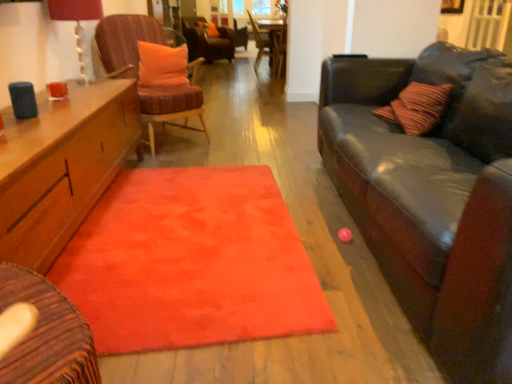
Question: Does orange fabric pillow at center, which ranks as the 1th pillow in top-to-bottom order, have a larger size compared to wooden table at center?

Choices:
 (A) no
 (B) yes

Answer: (A)

Question: Considering the relative positions of orange fabric pillow at center, the first pillow in the back-to-front sequence, and wooden table at center in the image provided, is orange fabric pillow at center, the first pillow in the back-to-front sequence, to the right of wooden table at center from the viewer's perspective?

Choices:
 (A) yes
 (B) no

Answer: (B)

Question: From the image's perspective, is orange fabric pillow at center, the 2th pillow in the bottom-to-top sequence, over wooden table at center?

Choices:
 (A) no
 (B) yes

Answer: (B)

Question: Are orange fabric pillow at center, which ranks as the 1th pillow in top-to-bottom order, and wooden table at center located far from each other?

Choices:
 (A) yes
 (B) no

Answer: (A)

Question: Considering the relative positions of orange fabric pillow at center, the first pillow in the back-to-front sequence, and wooden table at center in the image provided, is orange fabric pillow at center, the first pillow in the back-to-front sequence, to the left of wooden table at center from the viewer's perspective?

Choices:
 (A) yes
 (B) no

Answer: (A)

Question: Does orange fabric pillow at center, which ranks as the 1th pillow in top-to-bottom order, have a smaller size compared to wooden table at center?

Choices:
 (A) yes
 (B) no

Answer: (A)

Question: Is velvet brown armchair at center next to wooden table at center?

Choices:
 (A) no
 (B) yes

Answer: (B)

Question: From the image's perspective, is velvet brown armchair at center above wooden table at center?

Choices:
 (A) no
 (B) yes

Answer: (A)

Question: Is velvet brown armchair at center smaller than wooden table at center?

Choices:
 (A) no
 (B) yes

Answer: (B)

Question: Is velvet brown armchair at center positioned in front of wooden table at center?

Choices:
 (A) yes
 (B) no

Answer: (A)

Question: Is wooden table at center located within velvet brown armchair at center?

Choices:
 (A) no
 (B) yes

Answer: (A)

Question: Can you confirm if velvet brown armchair at center is wider than wooden table at center?

Choices:
 (A) yes
 (B) no

Answer: (B)

Question: Can you confirm if velvet brown armchair at center is wider than orange fabric pillow at upper center, the 2th pillow when ordered from back to front?

Choices:
 (A) no
 (B) yes

Answer: (B)